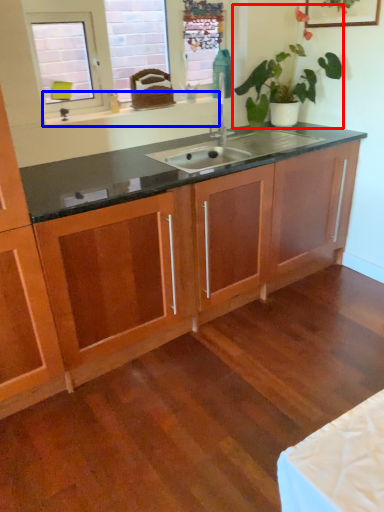
Question: Which object is closer to the camera taking this photo, houseplant (highlighted by a red box) or window sill (highlighted by a blue box)?

Choices:
 (A) houseplant
 (B) window sill

Answer: (A)